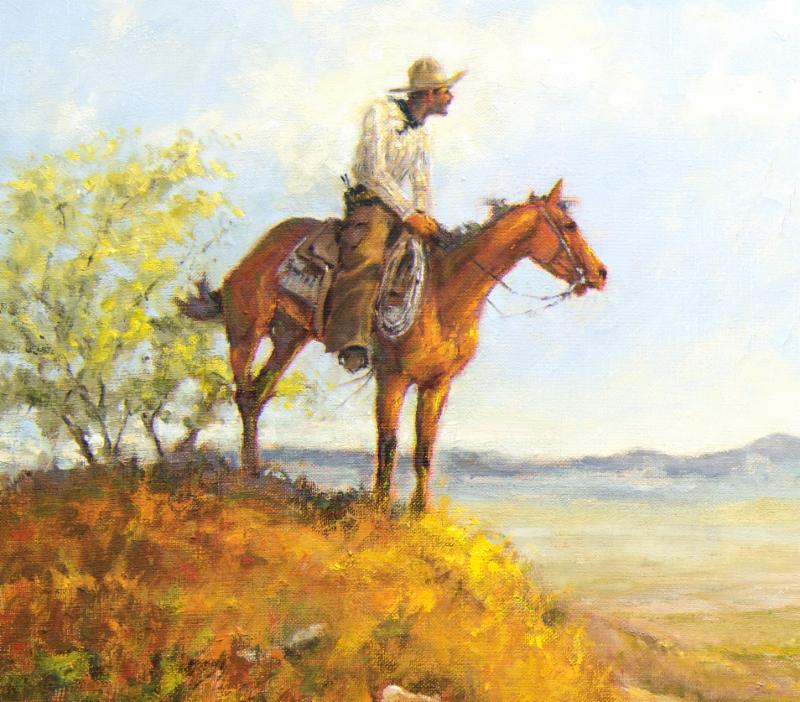
The height and width of the screenshot is (702, 800). I want to click on oil painting, so click(632, 211).